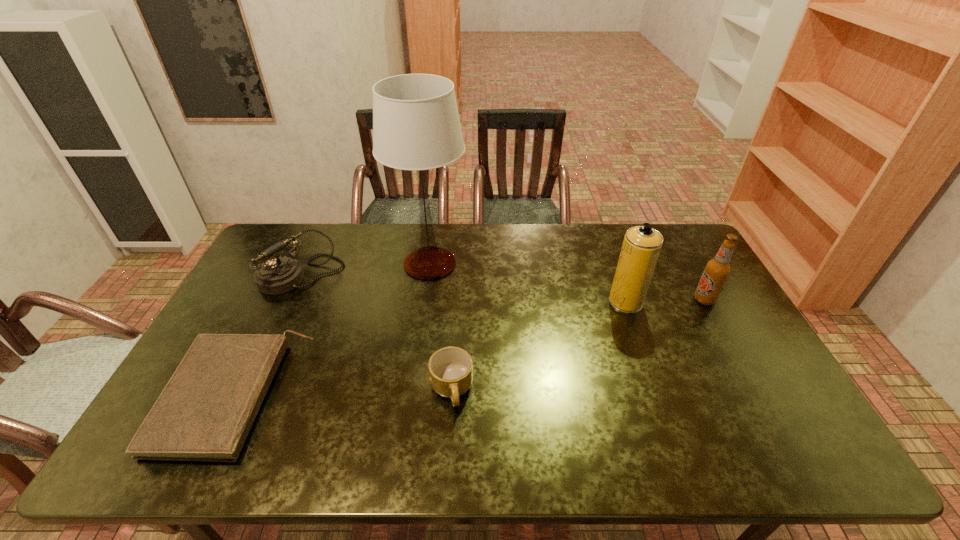
Locate an element on the screen. This screenshot has width=960, height=540. table lamp is located at coordinates (416, 126).

Identify the location of the second object from right to left. (641, 247).

Image resolution: width=960 pixels, height=540 pixels. What are the coordinates of `the second tallest object` in the screenshot? It's located at (641, 247).

Locate an element on the screen. This screenshot has height=540, width=960. beer bottle is located at coordinates (717, 270).

The width and height of the screenshot is (960, 540). Find the location of `the third tallest object`. the third tallest object is located at coordinates (717, 270).

At what (x,y) coordinates should I click in order to perform the action: click on the fourth tallest object. Please return your answer as a coordinate pair (x, y). Image resolution: width=960 pixels, height=540 pixels. Looking at the image, I should click on (278, 275).

Locate an element on the screen. mug is located at coordinates (451, 368).

I want to click on paperback book, so click(205, 412).

Where is `free space located above the cylindrical shade of the tallest object`? This screenshot has width=960, height=540. free space located above the cylindrical shade of the tallest object is located at coordinates (497, 264).

Locate an element on the screen. The image size is (960, 540). vacant space located 0.090m on the left of the second tallest object is located at coordinates (581, 302).